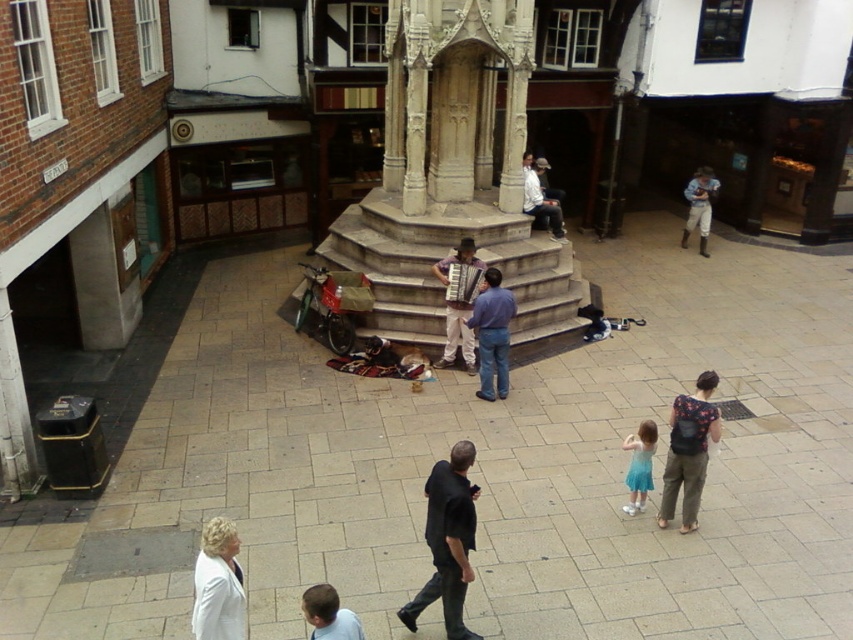
Question: Which object appears farthest from the camera in this image?

Choices:
 (A) matte brown accordion at center
 (B) light blue tulle skirt at lower center
 (C) light blue shirt at lower center

Answer: (A)

Question: Is white fabric jacket at lower left positioned in front of light brown leather jacket at center?

Choices:
 (A) yes
 (B) no

Answer: (A)

Question: Which point appears closest to the camera in this image?

Choices:
 (A) (514, 304)
 (B) (209, 572)
 (C) (686, 237)
 (D) (680, 396)

Answer: (B)

Question: Considering the real-world distances, which object is farthest from the light blue shirt at lower center?

Choices:
 (A) light blue tulle skirt at lower center
 (B) black matte shirt at center
 (C) light brown leather jacket at center
 (D) dark floral shirt at lower right

Answer: (C)

Question: Is dark floral shirt at lower right closer to the viewer compared to light blue tulle skirt at lower center?

Choices:
 (A) no
 (B) yes

Answer: (B)

Question: Does light blue shirt at lower center appear on the left side of blue denim jeans at right?

Choices:
 (A) no
 (B) yes

Answer: (B)